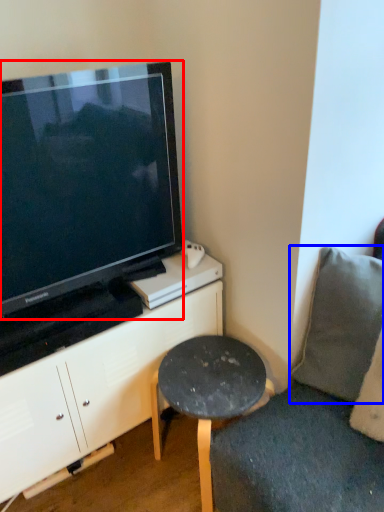
Question: Which object is closer to the camera taking this photo, television (highlighted by a red box) or pillow (highlighted by a blue box)?

Choices:
 (A) television
 (B) pillow

Answer: (A)